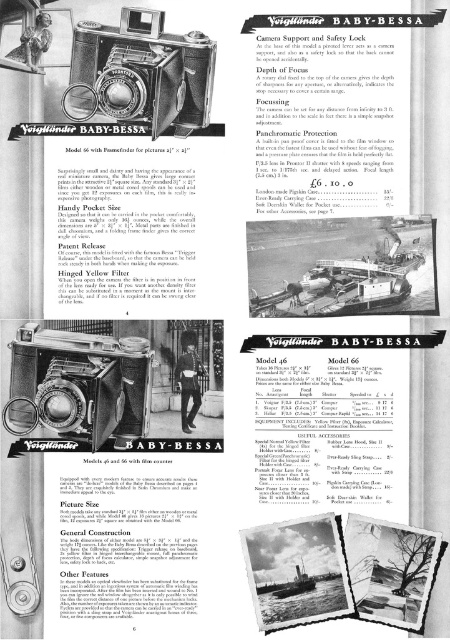
Question: Among these objects, which one is nearest to the camera?

Choices:
 (A) matte black camera at center
 (B) metallic silver camera at center

Answer: (A)

Question: Which of the following is the closest to the observer?

Choices:
 (A) matte black camera at center
 (B) metallic silver camera at center

Answer: (A)

Question: Among these objects, which one is farthest from the camera?

Choices:
 (A) metallic silver camera at center
 (B) matte black camera at center

Answer: (A)

Question: Is metallic silver camera at center thinner than matte black camera at center?

Choices:
 (A) yes
 (B) no

Answer: (A)

Question: Is metallic silver camera at center below matte black camera at center?

Choices:
 (A) no
 (B) yes

Answer: (B)

Question: Can you confirm if metallic silver camera at center is positioned below matte black camera at center?

Choices:
 (A) yes
 (B) no

Answer: (A)